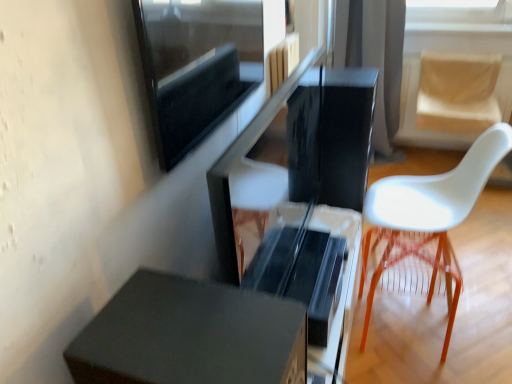
Image resolution: width=512 pixels, height=384 pixels. In order to click on white plastic chair at right in this screenshot , I will do `click(426, 221)`.

Where is `matte black drawer at lower left`? The height and width of the screenshot is (384, 512). matte black drawer at lower left is located at coordinates 190,336.

What do you see at coordinates (411, 270) in the screenshot? I see `translucent orange stool at right` at bounding box center [411, 270].

What do you see at coordinates (458, 92) in the screenshot? I see `beige fabric swivel chair at right` at bounding box center [458, 92].

This screenshot has height=384, width=512. Find the location of `white plastic chair at right`. white plastic chair at right is located at coordinates (426, 221).

Can you confirm if glossy black computer desk at center is positioned to the right of translucent orange stool at right?

Incorrect, glossy black computer desk at center is not on the right side of translucent orange stool at right.

Could you tell me if glossy black computer desk at center is turned towards translucent orange stool at right?

No, glossy black computer desk at center is not facing towards translucent orange stool at right.

Is point (367, 150) farther from camera compared to point (411, 275)?

Yes, point (367, 150) is behind point (411, 275).

Would you say matte black drawer at lower left is inside or outside translucent orange stool at right?

matte black drawer at lower left lies outside translucent orange stool at right.

Is matte black drawer at lower left at the right side of translucent orange stool at right?

Incorrect, matte black drawer at lower left is not on the right side of translucent orange stool at right.

Based on the photo, is matte black drawer at lower left turned away from translucent orange stool at right?

No, matte black drawer at lower left's orientation is not away from translucent orange stool at right.

Is beige fabric swivel chair at right not near translucent orange stool at right?

Yes.

At what (x,y) coordinates should I click in order to perform the action: click on swivel chair that is above the translucent orange stool at right (from the image's perspective). Please return your answer as a coordinate pair (x, y). Looking at the image, I should click on pyautogui.click(x=458, y=92).

Who is taller, beige fabric swivel chair at right or translucent orange stool at right?

translucent orange stool at right.

From a real-world perspective, who is located higher, beige fabric swivel chair at right or translucent orange stool at right?

From a 3D spatial view, beige fabric swivel chair at right is above.

Is matte black drawer at lower left thinner than beige fabric swivel chair at right?

Indeed, matte black drawer at lower left has a lesser width compared to beige fabric swivel chair at right.

Between matte black drawer at lower left and beige fabric swivel chair at right, which one has smaller size?

With smaller size is matte black drawer at lower left.

Considering the sizes of matte black drawer at lower left and beige fabric swivel chair at right in the image, is matte black drawer at lower left taller or shorter than beige fabric swivel chair at right?

matte black drawer at lower left is shorter than beige fabric swivel chair at right.

Does white plastic chair at right appear on the right side of beige fabric swivel chair at right?

In fact, white plastic chair at right is to the left of beige fabric swivel chair at right.

Does white plastic chair at right come behind beige fabric swivel chair at right?

No, white plastic chair at right is in front of beige fabric swivel chair at right.

Is white plastic chair at right facing towards beige fabric swivel chair at right?

No.

Is white plastic chair at right positioned far away from beige fabric swivel chair at right?

white plastic chair at right is positioned a significant distance from beige fabric swivel chair at right.

Can you confirm if black fabric curtain at upper center is smaller than glossy black computer desk at center?

No, black fabric curtain at upper center is not smaller than glossy black computer desk at center.

Can you confirm if black fabric curtain at upper center is thinner than glossy black computer desk at center?

In fact, black fabric curtain at upper center might be wider than glossy black computer desk at center.

Can you tell me how much black fabric curtain at upper center and glossy black computer desk at center differ in facing direction?

black fabric curtain at upper center and glossy black computer desk at center are facing 90.4 degrees away from each other.

Does black fabric curtain at upper center turn towards glossy black computer desk at center?

Yes, black fabric curtain at upper center is oriented towards glossy black computer desk at center.

Is point (345, 23) farther from camera compared to point (480, 97)?

Yes, point (345, 23) is behind point (480, 97).

From the image's perspective, is black fabric curtain at upper center above or below beige fabric swivel chair at right?

Based on their image positions, black fabric curtain at upper center is located above beige fabric swivel chair at right.

Measure the distance between black fabric curtain at upper center and beige fabric swivel chair at right.

The distance of black fabric curtain at upper center from beige fabric swivel chair at right is 15.84 inches.

Is black fabric curtain at upper center beside beige fabric swivel chair at right?

black fabric curtain at upper center and beige fabric swivel chair at right are clearly separated.

Where is `bar stool on the right side of glossy black computer desk at center`? bar stool on the right side of glossy black computer desk at center is located at coordinates (411, 270).

Identify the location of furniture on the left of translucent orange stool at right. (190, 336).

Estimate the real-world distances between objects in this image. Which object is closer to beige fabric swivel chair at right, glossy black computer desk at center or black fabric curtain at upper center?

black fabric curtain at upper center lies closer to beige fabric swivel chair at right than the other object.

Considering their positions, is beige fabric swivel chair at right positioned further to black fabric curtain at upper center than translucent orange stool at right?

translucent orange stool at right is positioned further to the anchor black fabric curtain at upper center.

Based on the photo, based on their spatial positions, is glossy black computer desk at center or matte black screen at upper left closer to beige fabric swivel chair at right?

Based on the image, glossy black computer desk at center appears to be nearer to beige fabric swivel chair at right.

Which object lies nearer to the anchor point white plastic chair at right, matte black screen at upper left or matte black drawer at lower left?

Among the two, matte black screen at upper left is located nearer to white plastic chair at right.

Based on their spatial positions, is glossy black computer desk at center or matte black screen at upper left closer to matte black drawer at lower left?

glossy black computer desk at center is closer to matte black drawer at lower left.

Estimate the real-world distances between objects in this image. Which object is closer to glossy black computer desk at center, translucent orange stool at right or matte black screen at upper left?

Among the two, matte black screen at upper left is located nearer to glossy black computer desk at center.

Estimate the real-world distances between objects in this image. Which object is closer to beige fabric swivel chair at right, glossy black computer desk at center or matte black drawer at lower left?

Among the two, glossy black computer desk at center is located nearer to beige fabric swivel chair at right.

Estimate the real-world distances between objects in this image. Which object is closer to matte black screen at upper left, matte black drawer at lower left or black fabric curtain at upper center?

matte black drawer at lower left is closer to matte black screen at upper left.

Where is `chair located between glossy black computer desk at center and black fabric curtain at upper center in the depth direction`? This screenshot has width=512, height=384. chair located between glossy black computer desk at center and black fabric curtain at upper center in the depth direction is located at coordinates (426, 221).

Image resolution: width=512 pixels, height=384 pixels. Identify the location of window screen located between glossy black computer desk at center and black fabric curtain at upper center in the depth direction. (197, 66).

I want to click on chair positioned between matte black drawer at lower left and black fabric curtain at upper center from near to far, so click(426, 221).

Where is `chair between glossy black computer desk at center and translucent orange stool at right along the z-axis`? The image size is (512, 384). chair between glossy black computer desk at center and translucent orange stool at right along the z-axis is located at coordinates (426, 221).